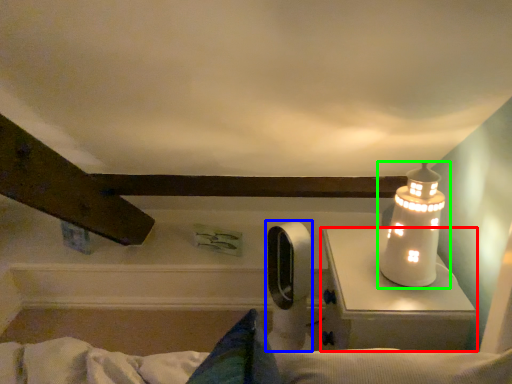
Question: Which is farther away from table (highlighted by a red box)? equipment (highlighted by a blue box) or lamp (highlighted by a green box)?

Choices:
 (A) equipment
 (B) lamp

Answer: (A)